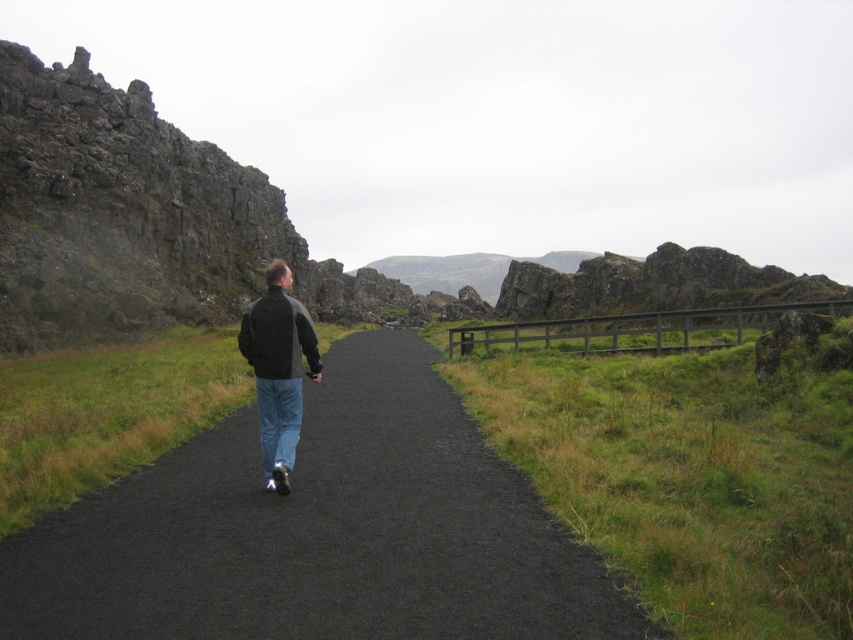
Question: Which point is closer to the camera taking this photo?

Choices:
 (A) (264, 408)
 (B) (276, 376)
 (C) (277, 452)

Answer: (B)

Question: Which object is farther from the camera taking this photo?

Choices:
 (A) black asphalt trail at center
 (B) dark gray jacket at center

Answer: (B)

Question: In this image, where is dark gray fleece jacket at center located relative to blue denim jeans at center?

Choices:
 (A) left
 (B) right

Answer: (A)

Question: Which point is closer to the camera?

Choices:
 (A) (260, 371)
 (B) (424, 451)

Answer: (A)

Question: Can you confirm if black asphalt trail at center is positioned to the left of dark gray jacket at center?

Choices:
 (A) yes
 (B) no

Answer: (B)

Question: Does black asphalt trail at center come behind blue denim jeans at center?

Choices:
 (A) yes
 (B) no

Answer: (B)